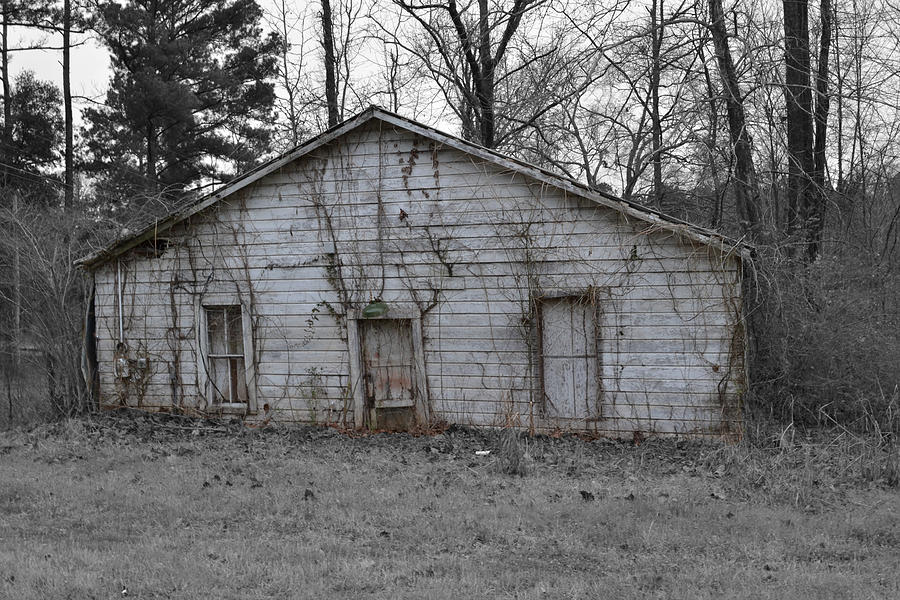
The width and height of the screenshot is (900, 600). I want to click on planks, so click(x=502, y=203), click(x=498, y=237), click(x=499, y=281), click(x=504, y=312).